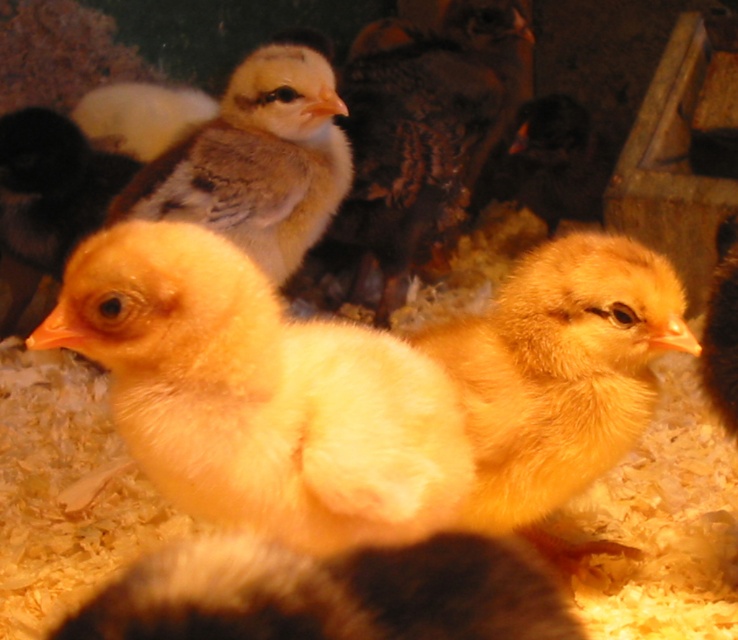
You are holding a small toy that needs to be placed exactly 40 inches away from the camera. You see the yellow downy chick at center in the image. Can you use the chick as a reference to determine if placing the toy at the same distance as the chick would meet the requirement?

The yellow downy chick at center is 39.33 inches away from the camera. Since 39.33 inches is slightly less than 40 inches, placing the toy at the same distance as the chick would be just under the required distance. To meet the exact 40 inches, you would need to move the toy slightly further away from the camera than the chick.

From the picture: You are a farmer checking the chicks in the pen. You need to locate the yellow downy chick at center. Where exactly is it positioned in the image?

The yellow downy chick at center is positioned at the 2D coordinates of point 0.616 on the x axis and 0.351 on the y axis.